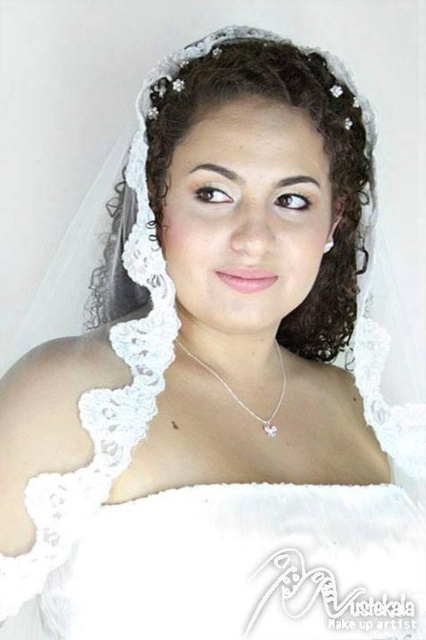
Question: Does curly white veil at center lie behind silver/pearl necklace at center?

Choices:
 (A) yes
 (B) no

Answer: (B)

Question: Is curly white veil at center smaller than silver/pearl necklace at center?

Choices:
 (A) no
 (B) yes

Answer: (A)

Question: Which object is farther from the camera taking this photo?

Choices:
 (A) silver/pearl necklace at center
 (B) curly white veil at center

Answer: (A)

Question: Which point appears farthest from the camera in this image?

Choices:
 (A) (344, 244)
 (B) (187, 355)

Answer: (A)

Question: Can you confirm if curly white veil at center is bigger than silver/pearl necklace at center?

Choices:
 (A) yes
 (B) no

Answer: (A)

Question: Which object appears farthest from the camera in this image?

Choices:
 (A) silver/pearl necklace at center
 (B) curly white veil at center

Answer: (A)